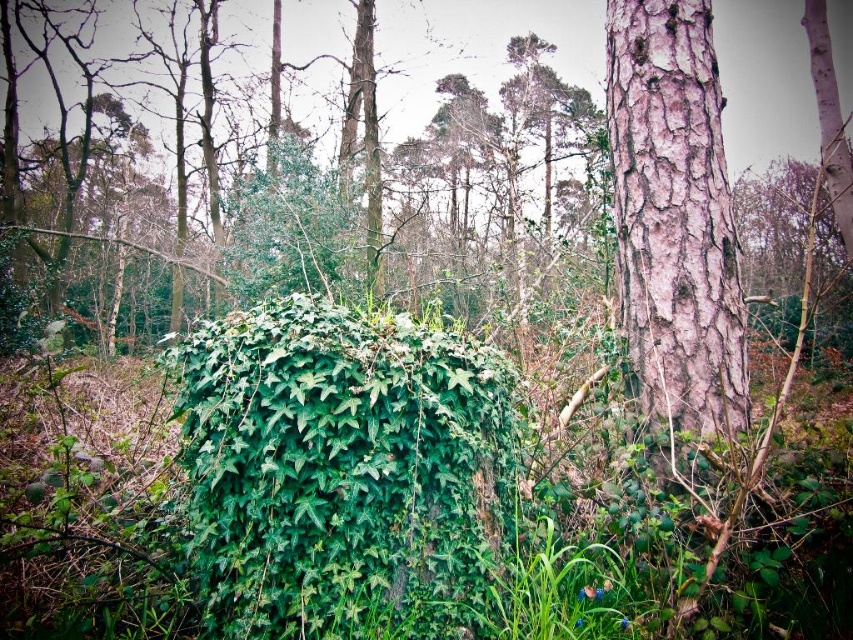
Question: Does green leafy bush at center have a greater width compared to smooth pink bark at right?

Choices:
 (A) no
 (B) yes

Answer: (B)

Question: Among these objects, which one is farthest from the camera?

Choices:
 (A) smooth pink bark at right
 (B) green leafy bush at center

Answer: (A)

Question: Does green leafy bush at center appear on the left side of smooth pink bark at right?

Choices:
 (A) yes
 (B) no

Answer: (A)

Question: In this image, where is green leafy bush at center located relative to smooth pink bark at right?

Choices:
 (A) left
 (B) right

Answer: (A)